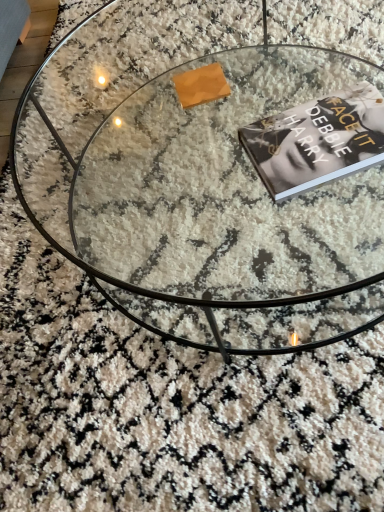
Measure the distance between transparent glass coffee table at center and camera.

25.49 inches.

You are a GUI agent. You are given a task and a screenshot of the screen. Output one action in this format:
    pyautogui.click(x=<x>, y=<y>)
    Task: Click on the transparent glass coffee table at center
    
    Given the screenshot: What is the action you would take?
    pyautogui.click(x=159, y=292)

The height and width of the screenshot is (512, 384). Describe the element at coordinates (159, 292) in the screenshot. I see `transparent glass coffee table at center` at that location.

The width and height of the screenshot is (384, 512). What are the coordinates of `black matte book at center` in the screenshot? It's located at (317, 140).

Measure the distance between point (x=308, y=147) and camera.

The distance of point (x=308, y=147) from camera is 71.10 centimeters.

The width and height of the screenshot is (384, 512). What do you see at coordinates (317, 140) in the screenshot?
I see `black matte book at center` at bounding box center [317, 140].

What are the coordinates of `transparent glass coffee table at center` in the screenshot? It's located at (159, 292).

Would you say black matte book at center is to the left or to the right of transparent glass coffee table at center in the picture?

Based on their positions, black matte book at center is located to the right of transparent glass coffee table at center.

Who is more distant, black matte book at center or transparent glass coffee table at center?

Positioned behind is black matte book at center.

Between point (265, 168) and point (91, 276), which one is positioned behind?

Point (91, 276)

From the image's perspective, which one is positioned lower, black matte book at center or transparent glass coffee table at center?

From the image's view, black matte book at center is below.

From a real-world perspective, relative to transparent glass coffee table at center, is black matte book at center vertically above or below?

Clearly, from a real-world perspective, black matte book at center is above transparent glass coffee table at center.

Between black matte book at center and transparent glass coffee table at center, which one has smaller width?

Thinner between the two is black matte book at center.

Considering the sizes of objects black matte book at center and transparent glass coffee table at center in the image provided, who is taller, black matte book at center or transparent glass coffee table at center?

transparent glass coffee table at center is taller.

Considering the sizes of objects black matte book at center and transparent glass coffee table at center in the image provided, who is smaller, black matte book at center or transparent glass coffee table at center?

black matte book at center.

Is black matte book at center completely or partially outside of transparent glass coffee table at center?

No, most part of black matte book at center lies within transparent glass coffee table at center.

Is black matte book at center not close to transparent glass coffee table at center?

No, black matte book at center is in close proximity to transparent glass coffee table at center.

Is black matte book at center turned away from transparent glass coffee table at center?

black matte book at center is not turned away from transparent glass coffee table at center.

I want to click on coffee table on the left side of black matte book at center, so click(159, 292).

Considering the relative positions of transparent glass coffee table at center and black matte book at center in the image provided, is transparent glass coffee table at center to the right of black matte book at center from the viewer's perspective?

Incorrect, transparent glass coffee table at center is not on the right side of black matte book at center.

Is transparent glass coffee table at center closer to the viewer compared to black matte book at center?

Yes.

Does point (300, 302) come farther from viewer compared to point (303, 141)?

That is True.

From the image's perspective, would you say transparent glass coffee table at center is positioned over black matte book at center?

Yes.

From a real-world perspective, is transparent glass coffee table at center positioned above or below black matte book at center?

transparent glass coffee table at center is below black matte book at center.

Between transparent glass coffee table at center and black matte book at center, which one has larger width?

With larger width is transparent glass coffee table at center.

Can you confirm if transparent glass coffee table at center is shorter than black matte book at center?

In fact, transparent glass coffee table at center may be taller than black matte book at center.

Between transparent glass coffee table at center and black matte book at center, which one has smaller size?

black matte book at center.

Is transparent glass coffee table at center surrounding black matte book at center?

Yes, transparent glass coffee table at center contains black matte book at center.

Are transparent glass coffee table at center and black matte book at center beside each other?

No.

Is transparent glass coffee table at center facing away from black matte book at center?

No.

This screenshot has width=384, height=512. Find the location of `paperback book above the transparent glass coffee table at center (from a real-world perspective)`. paperback book above the transparent glass coffee table at center (from a real-world perspective) is located at coordinates (317, 140).

At what (x,y) coordinates should I click in order to perform the action: click on paperback book on the right of transparent glass coffee table at center. Please return your answer as a coordinate pair (x, y). Looking at the image, I should click on (317, 140).

Find the location of a particular element. paperback book behind the transparent glass coffee table at center is located at coordinates (317, 140).